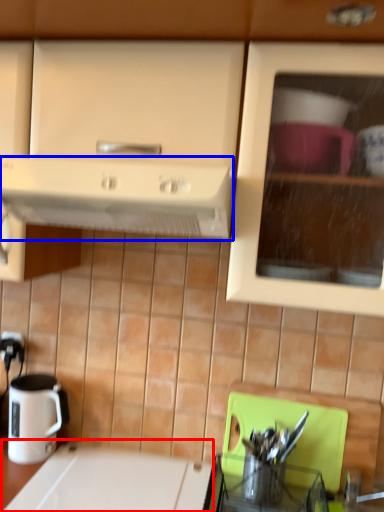
Question: Which of the following is the farthest to the observer, counter top (highlighted by a red box) or kitchen appliance (highlighted by a blue box)?

Choices:
 (A) counter top
 (B) kitchen appliance

Answer: (A)